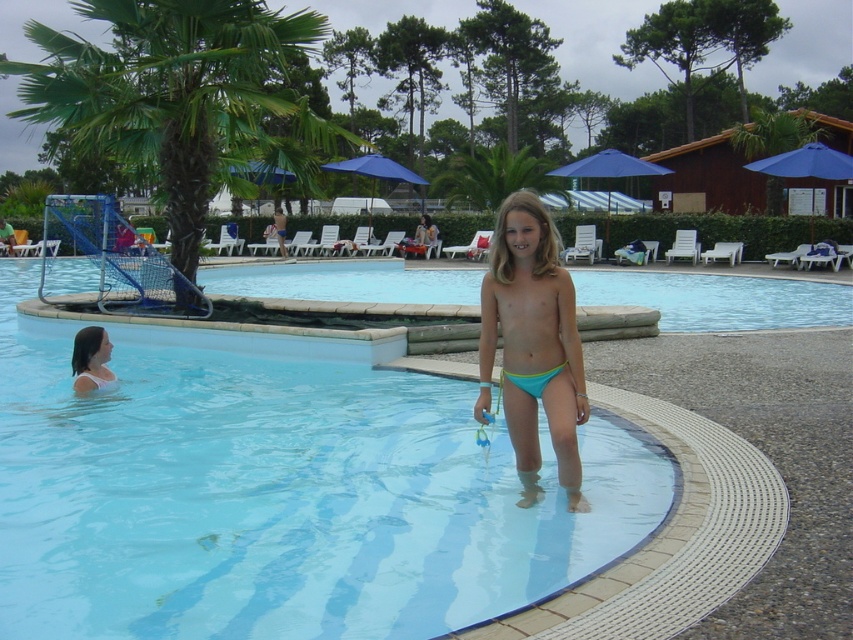
You are designing a safety poster for the pool area and need to mention the height difference between the clear plastic pool at center and the neon green fabric bikini at center. Which object is taller?

The clear plastic pool at center is taller than the neon green fabric bikini at center.

You are standing at the edge of the clear plastic pool at center and want to reach the clear blue water at center. Which direction should you move to get there?

The clear plastic pool at center is below clear blue water at center, so you should move upward to reach the clear blue water at center.